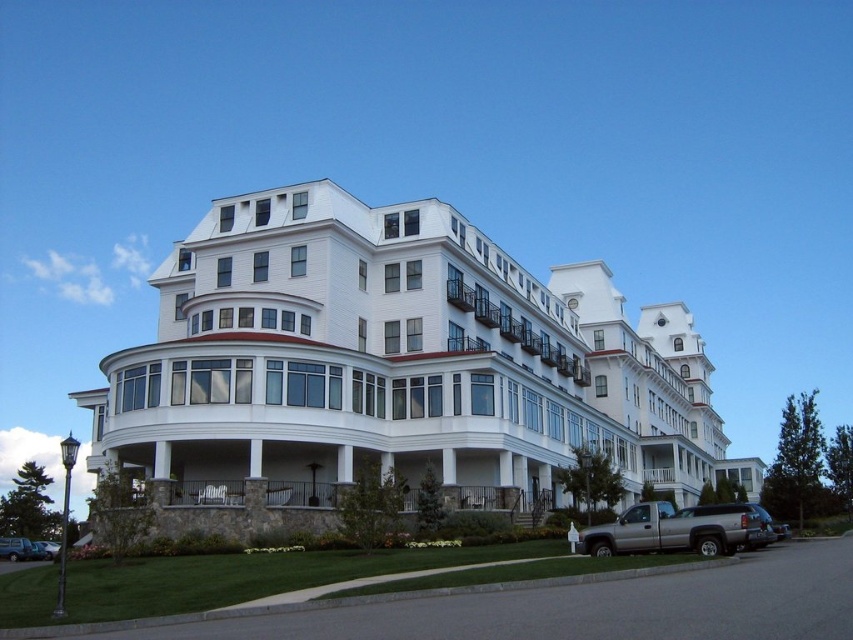
You are a delivery driver with a truck that needs to unload packages at the white painted wood balcony at center. The silver metallic truck at lower right is parked 25.57 meters away from the balcony. Can you safely drive your truck from the current position to the balcony within the 25 meters designated unloading zone?

The distance between the white painted wood balcony at center and the silver metallic truck at lower right is 25.57 meters, which exceeds the 25 meters designated unloading zone. Therefore, the truck cannot safely reach the balcony within the allowed distance.

You are standing in front of the grand white building and want to take a photo. You notice two points marked on the building facade. The first point is at coordinates point (x=483, y=321) and the second is at point (x=758, y=540). Which point is closer to your camera when taking the photo?

Point (x=758, y=540) is closer to the camera because it is less further away than point (x=483, y=321), which is further away from the camera.